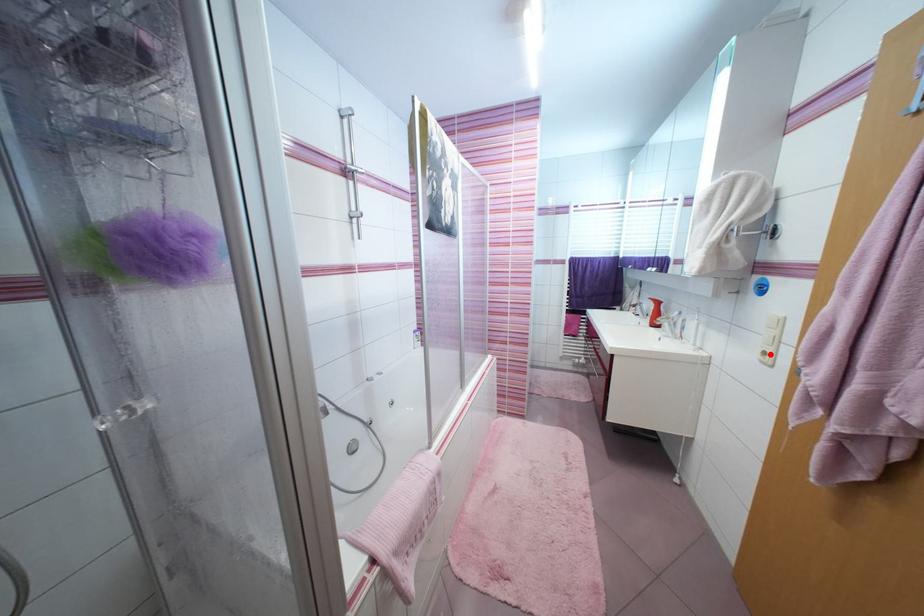
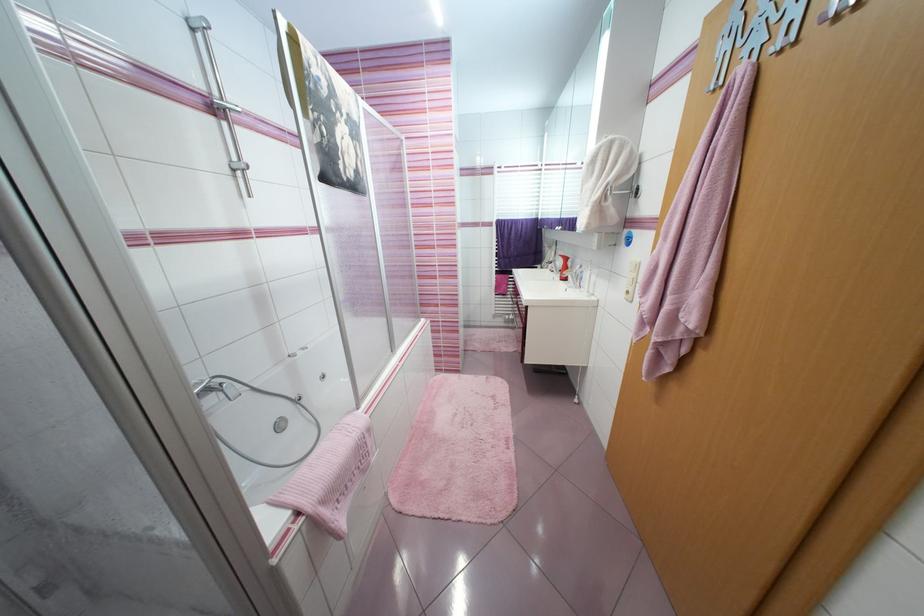
Question: I am providing you with two images of the same scene from different viewpoints. In image1, a red point is highlighted. Considering the same 3D point in image2, which of the following is correct?

Choices:
 (A) It is closer
 (B) It is farther

Answer: (A)